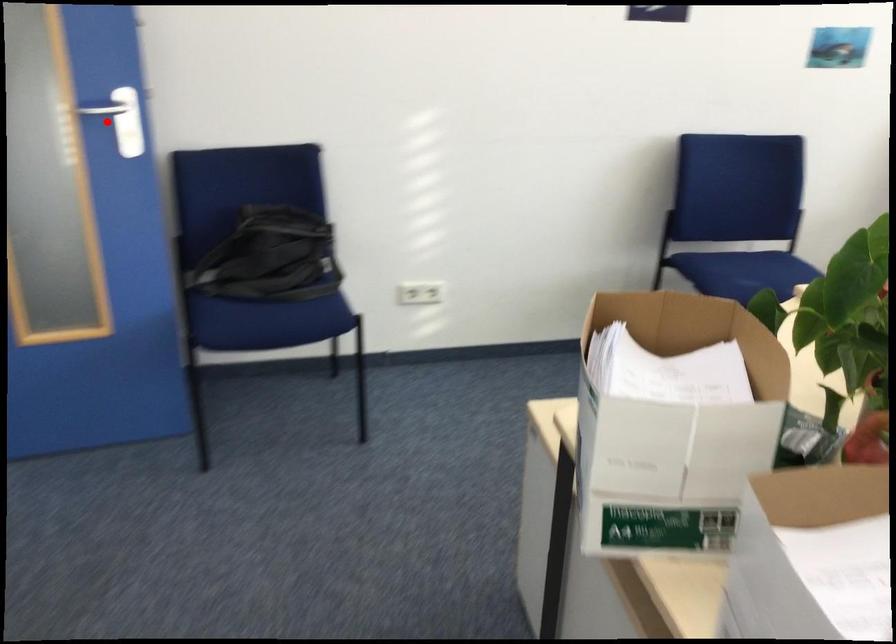
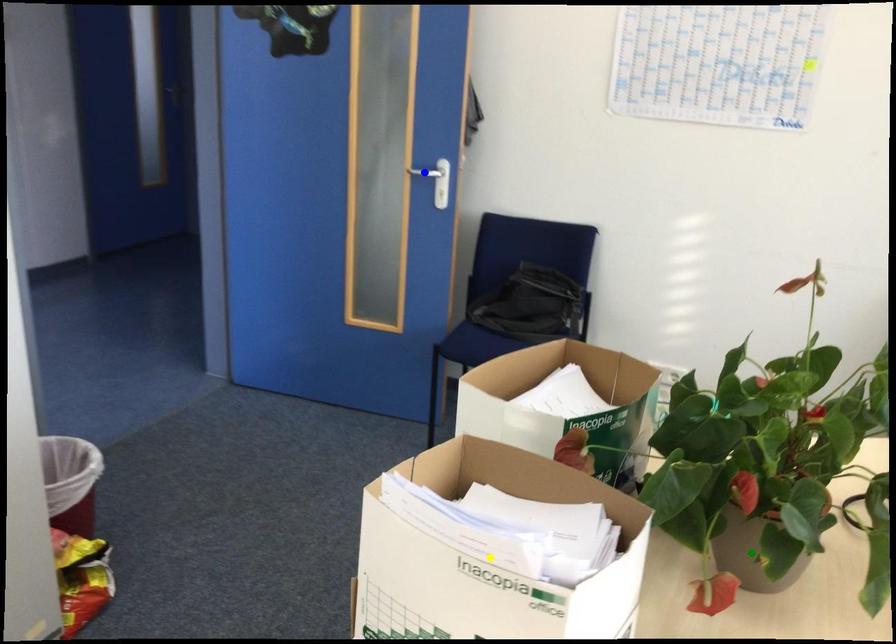
Question: I am providing you with two images of the same scene from different viewpoints. A red point is marked on the first image. You are given multiple points on the second image. Which point in image 2 is actually the same real-world point as the red point in image 1?

Choices:
 (A) yellow point
 (B) blue point
 (C) green point

Answer: (B)